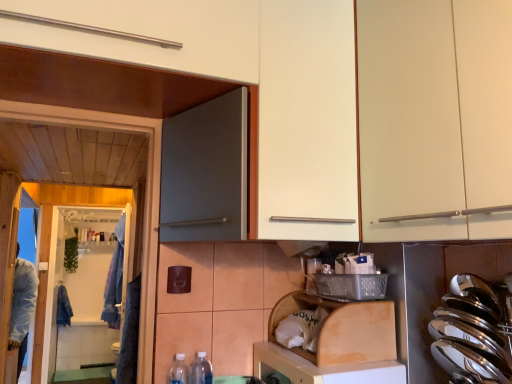
This screenshot has height=384, width=512. Find the location of `denim jacket at left, which ranks as the first laundry in right-to-left order`. denim jacket at left, which ranks as the first laundry in right-to-left order is located at coordinates (115, 279).

What do you see at coordinates (335, 344) in the screenshot?
I see `wooden dish washer at lower center, which is the 1th dish washer in top-to-bottom order` at bounding box center [335, 344].

What do you see at coordinates (85, 292) in the screenshot? The width and height of the screenshot is (512, 384). I see `white glossy screen door at lower left` at bounding box center [85, 292].

What is the approximate height of white matte cabinet at upper right?

white matte cabinet at upper right is 34.72 inches in height.

The height and width of the screenshot is (384, 512). Describe the element at coordinates (63, 307) in the screenshot. I see `denim jacket at left, which appears as the second laundry when viewed from the right` at that location.

The width and height of the screenshot is (512, 384). What do you see at coordinates (470, 333) in the screenshot?
I see `polished stainless steel spoons at right` at bounding box center [470, 333].

Find the location of a particular element. Image resolution: width=512 pixels, height=384 pixels. denim jacket at left, the 2th laundry viewed from the left is located at coordinates (115, 279).

From a real-world perspective, which is physically below, polished stainless steel spoons at right or clear plastic bottle at lower center?

clear plastic bottle at lower center is physically lower.

What's the angular difference between polished stainless steel spoons at right and clear plastic bottle at lower center's facing directions?

89.5 degrees.

Is polished stainless steel spoons at right oriented away from clear plastic bottle at lower center?

No, polished stainless steel spoons at right's orientation is not away from clear plastic bottle at lower center.

Find the location of a particular element. Image resolution: width=512 pixels, height=384 pixels. bottle that appears behind the polished stainless steel spoons at right is located at coordinates (201, 370).

From a real-world perspective, is wooden dishwasher at lower center, which ranks as the first dish washer in bottom-to-top order, over white matte cabinet at upper right?

Incorrect, from a real-world perspective, wooden dishwasher at lower center, which ranks as the first dish washer in bottom-to-top order, is lower than white matte cabinet at upper right.

Is wooden dishwasher at lower center, positioned as the second dish washer in top-to-bottom order, touching white matte cabinet at upper right?

They are not placed beside each other.

Can you confirm if wooden dishwasher at lower center, positioned as the second dish washer in top-to-bottom order, is positioned to the right of white matte cabinet at upper right?

In fact, wooden dishwasher at lower center, positioned as the second dish washer in top-to-bottom order, is to the left of white matte cabinet at upper right.

Looking at this image, from the image's perspective, is wooden dishwasher at lower center, which ranks as the first dish washer in bottom-to-top order, over white matte cabinet at upper right?

Actually, wooden dishwasher at lower center, which ranks as the first dish washer in bottom-to-top order, appears below white matte cabinet at upper right in the image.

From a real-world perspective, is polished stainless steel spoons at right under white matte cabinet at upper right?

Yes, from a real-world perspective, polished stainless steel spoons at right is under white matte cabinet at upper right.

From the image's perspective, is polished stainless steel spoons at right located above white matte cabinet at upper right?

No, from the image's perspective, polished stainless steel spoons at right is not above white matte cabinet at upper right.

Is polished stainless steel spoons at right placed right next to white matte cabinet at upper right?

No, polished stainless steel spoons at right is not in contact with white matte cabinet at upper right.

Considering the relative sizes of polished stainless steel spoons at right and white matte cabinet at upper right in the image provided, is polished stainless steel spoons at right wider than white matte cabinet at upper right?

Incorrect, the width of polished stainless steel spoons at right does not surpass that of white matte cabinet at upper right.

Is point (115, 326) farther from camera compared to point (388, 108)?

Yes.

From the image's perspective, which is below, denim jacket at left, which ranks as the first laundry in right-to-left order, or white matte cabinet at upper right?

denim jacket at left, which ranks as the first laundry in right-to-left order, is shown below in the image.

Is denim jacket at left, the second laundry when ordered from back to front, inside or outside of white matte cabinet at upper right?

denim jacket at left, the second laundry when ordered from back to front, lies outside white matte cabinet at upper right.

Could you tell me if denim jacket at left, the 2th laundry viewed from the left, is turned towards white matte cabinet at upper right?

No, denim jacket at left, the 2th laundry viewed from the left, is not turned towards white matte cabinet at upper right.

Who is taller, denim jacket at left, the 2th laundry viewed from the left, or wooden dishwasher at lower center, which ranks as the first dish washer in bottom-to-top order?

Standing taller between the two is denim jacket at left, the 2th laundry viewed from the left.

Is denim jacket at left, the 2th laundry viewed from the left, next to wooden dishwasher at lower center, positioned as the second dish washer in top-to-bottom order, and touching it?

No, denim jacket at left, the 2th laundry viewed from the left, is not making contact with wooden dishwasher at lower center, positioned as the second dish washer in top-to-bottom order.

From the image's perspective, is denim jacket at left, placed as the first laundry when sorted from front to back, on top of wooden dishwasher at lower center, positioned as the second dish washer in top-to-bottom order?

No.

Considering the relative sizes of denim jacket at left, the 2th laundry viewed from the left, and wooden dishwasher at lower center, which ranks as the first dish washer in bottom-to-top order, in the image provided, is denim jacket at left, the 2th laundry viewed from the left, thinner than wooden dishwasher at lower center, which ranks as the first dish washer in bottom-to-top order,?

In fact, denim jacket at left, the 2th laundry viewed from the left, might be wider than wooden dishwasher at lower center, which ranks as the first dish washer in bottom-to-top order.

Is point (280, 355) in front of point (286, 365)?

No, (280, 355) is behind (286, 365).

Which of these two, wooden dishwasher at lower center, positioned as the second dish washer in top-to-bottom order, or wooden dish washer at lower center, which is the 1th dish washer in top-to-bottom order, is thinner?

wooden dish washer at lower center, which is the 1th dish washer in top-to-bottom order, is thinner.

Considering the sizes of objects wooden dishwasher at lower center, which ranks as the first dish washer in bottom-to-top order, and wooden dish washer at lower center, which is the 1th dish washer in top-to-bottom order, in the image provided, who is taller, wooden dishwasher at lower center, which ranks as the first dish washer in bottom-to-top order, or wooden dish washer at lower center, which is the 1th dish washer in top-to-bottom order,?

Standing taller between the two is wooden dishwasher at lower center, which ranks as the first dish washer in bottom-to-top order.

You are a GUI agent. You are given a task and a screenshot of the screen. Output one action in this format:
    pyautogui.click(x=<x>, y=<y>)
    Task: Click on the dish washer below the wooden dish washer at lower center, the second dish washer when ordered from bottom to top (from a real-world perspective)
    The image size is (512, 384).
    Given the screenshot: What is the action you would take?
    pyautogui.click(x=320, y=369)

Between white glossy screen door at lower left and denim jacket at left, acting as the first laundry starting from the back, which one has smaller size?

white glossy screen door at lower left is smaller.

From the picture: From a real-world perspective, is white glossy screen door at lower left beneath denim jacket at left, acting as the first laundry starting from the back?

Incorrect, from a real-world perspective, white glossy screen door at lower left is higher than denim jacket at left, acting as the first laundry starting from the back.

Considering the relative sizes of white glossy screen door at lower left and denim jacket at left, which appears as the second laundry when viewed from the right, in the image provided, is white glossy screen door at lower left thinner than denim jacket at left, which appears as the second laundry when viewed from the right,?

Yes, white glossy screen door at lower left is thinner than denim jacket at left, which appears as the second laundry when viewed from the right.

Considering the relative sizes of white glossy screen door at lower left and denim jacket at left, the 2th laundry when ordered from front to back, in the image provided, is white glossy screen door at lower left taller than denim jacket at left, the 2th laundry when ordered from front to back,?

Indeed, white glossy screen door at lower left has a greater height compared to denim jacket at left, the 2th laundry when ordered from front to back.

This screenshot has height=384, width=512. What are the coordinates of `bottle behind the polished stainless steel spoons at right` in the screenshot? It's located at (201, 370).

Image resolution: width=512 pixels, height=384 pixels. There is a wooden dishwasher at lower center, positioned as the second dish washer in top-to-bottom order. Find the location of `cabinetry above it (from a real-world perspective)`. cabinetry above it (from a real-world perspective) is located at coordinates (435, 115).

In the scene shown: Looking at the image, which one is located closer to clear plastic bottle at lower center, white matte cabinet at upper right or polished stainless steel spoons at right?

polished stainless steel spoons at right lies closer to clear plastic bottle at lower center than the other object.

Estimate the real-world distances between objects in this image. Which object is further from clear plastic bottle at lower center, wooden dish washer at lower center, which is the 1th dish washer in top-to-bottom order, or denim jacket at left, placed as the first laundry when sorted from front to back?

The object further to clear plastic bottle at lower center is denim jacket at left, placed as the first laundry when sorted from front to back.

Considering their positions, is polished stainless steel spoons at right positioned closer to clear plastic bottle at lower center than wooden dishwasher at lower center, which ranks as the first dish washer in bottom-to-top order?

wooden dishwasher at lower center, which ranks as the first dish washer in bottom-to-top order, is positioned closer to the anchor clear plastic bottle at lower center.

Based on their spatial positions, is white glossy screen door at lower left or wooden dish washer at lower center, which is the 1th dish washer in top-to-bottom order, further from polished stainless steel spoons at right?

white glossy screen door at lower left lies further to polished stainless steel spoons at right than the other object.

Looking at the image, which one is located closer to wooden dishwasher at lower center, positioned as the second dish washer in top-to-bottom order, polished stainless steel spoons at right or denim jacket at left, placed as the first laundry when sorted from front to back?

The object closer to wooden dishwasher at lower center, positioned as the second dish washer in top-to-bottom order, is polished stainless steel spoons at right.

Looking at the image, which one is located further to denim jacket at left, placed as the first laundry when sorted from front to back, white glossy screen door at lower left or wooden dishwasher at lower center, positioned as the second dish washer in top-to-bottom order?

wooden dishwasher at lower center, positioned as the second dish washer in top-to-bottom order, lies further to denim jacket at left, placed as the first laundry when sorted from front to back, than the other object.

Based on their spatial positions, is white matte cabinet at upper right or clear plastic bottle at lower center further from wooden dish washer at lower center, which is the 1th dish washer in top-to-bottom order?

The object further to wooden dish washer at lower center, which is the 1th dish washer in top-to-bottom order, is white matte cabinet at upper right.

When comparing their distances from denim jacket at left, the second laundry when ordered from back to front, does wooden dish washer at lower center, the second dish washer when ordered from bottom to top, or wooden dishwasher at lower center, positioned as the second dish washer in top-to-bottom order, seem further?

The object further to denim jacket at left, the second laundry when ordered from back to front, is wooden dishwasher at lower center, positioned as the second dish washer in top-to-bottom order.

Find the location of a particular element. bottle between wooden dish washer at lower center, the second dish washer when ordered from bottom to top, and denim jacket at left, which appears as the second laundry when viewed from the right, along the z-axis is located at coordinates (201, 370).

You are a GUI agent. You are given a task and a screenshot of the screen. Output one action in this format:
    pyautogui.click(x=<x>, y=<y>)
    Task: Click on the bottle positioned between polished stainless steel spoons at right and white glossy screen door at lower left from near to far
    The width and height of the screenshot is (512, 384).
    Given the screenshot: What is the action you would take?
    pyautogui.click(x=201, y=370)

You are a GUI agent. You are given a task and a screenshot of the screen. Output one action in this format:
    pyautogui.click(x=<x>, y=<y>)
    Task: Click on the bottle between wooden dish washer at lower center, the second dish washer when ordered from bottom to top, and white glossy screen door at lower left in the front-back direction
    Image resolution: width=512 pixels, height=384 pixels.
    Given the screenshot: What is the action you would take?
    pyautogui.click(x=201, y=370)

The image size is (512, 384). In order to click on laundry located between wooden dish washer at lower center, the second dish washer when ordered from bottom to top, and white glossy screen door at lower left in the depth direction in this screenshot , I will do `click(115, 279)`.